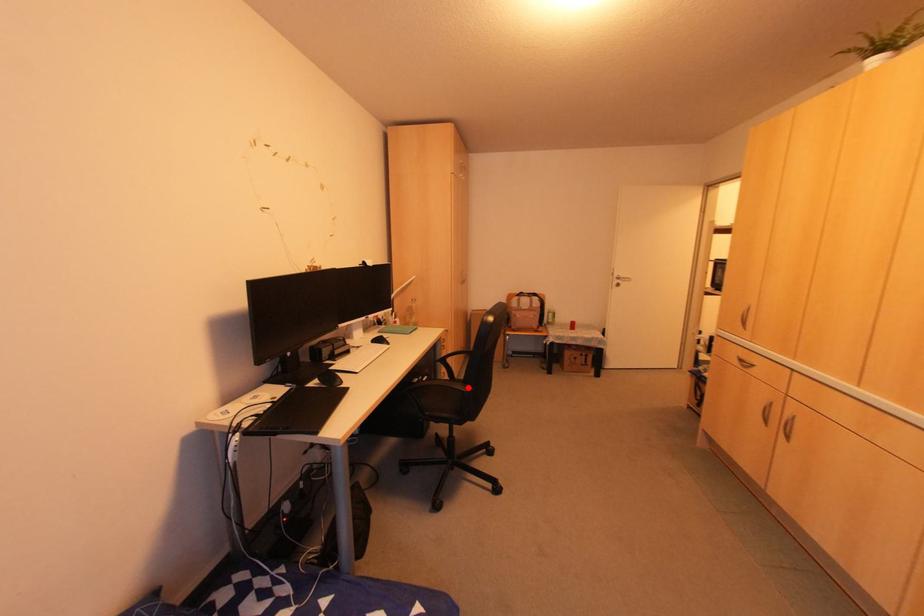
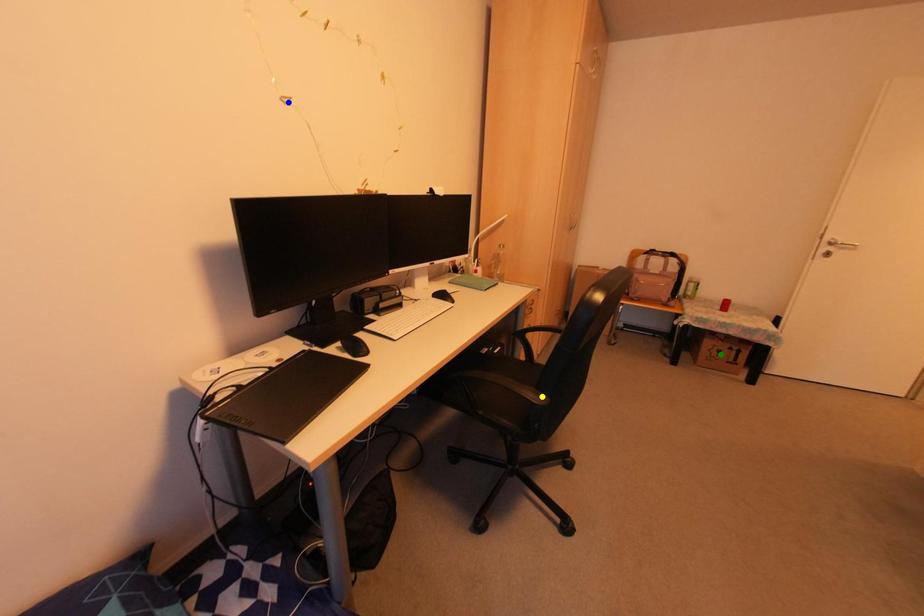
Question: I am providing you with two images of the same scene from different viewpoints. A red point is marked on the first image. You are given multiple points on the second image. Which spot in image 2 lines up with the point in image 1?

Choices:
 (A) blue point
 (B) yellow point
 (C) green point

Answer: (B)